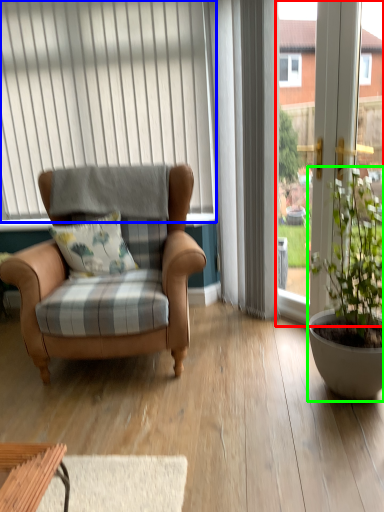
Question: Estimate the real-world distances between objects in this image. Which object is closer to window frame (highlighted by a red box), curtain (highlighted by a blue box) or houseplant (highlighted by a green box)?

Choices:
 (A) curtain
 (B) houseplant

Answer: (B)